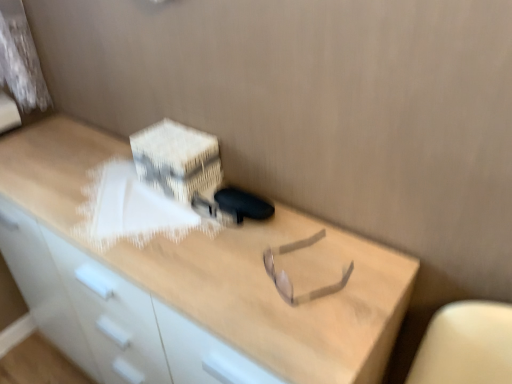
Question: From a real-world perspective, is light wood desk at center positioned above or below white cardboard box at upper center?

Choices:
 (A) above
 (B) below

Answer: (B)

Question: Does point (3, 180) appear closer or farther from the camera than point (150, 173)?

Choices:
 (A) closer
 (B) farther

Answer: (B)

Question: Considering the relative positions of light wood desk at center and white cardboard box at upper center in the image provided, is light wood desk at center to the left or to the right of white cardboard box at upper center?

Choices:
 (A) left
 (B) right

Answer: (A)

Question: From a real-world perspective, is white cardboard box at upper center positioned above or below light wood desk at center?

Choices:
 (A) above
 (B) below

Answer: (A)

Question: Is white cardboard box at upper center wider or thinner than light wood desk at center?

Choices:
 (A) thin
 (B) wide

Answer: (A)

Question: Is white cardboard box at upper center in front of or behind light wood desk at center in the image?

Choices:
 (A) behind
 (B) front

Answer: (A)

Question: Is point (172, 185) closer or farther from the camera than point (294, 291)?

Choices:
 (A) closer
 (B) farther

Answer: (B)